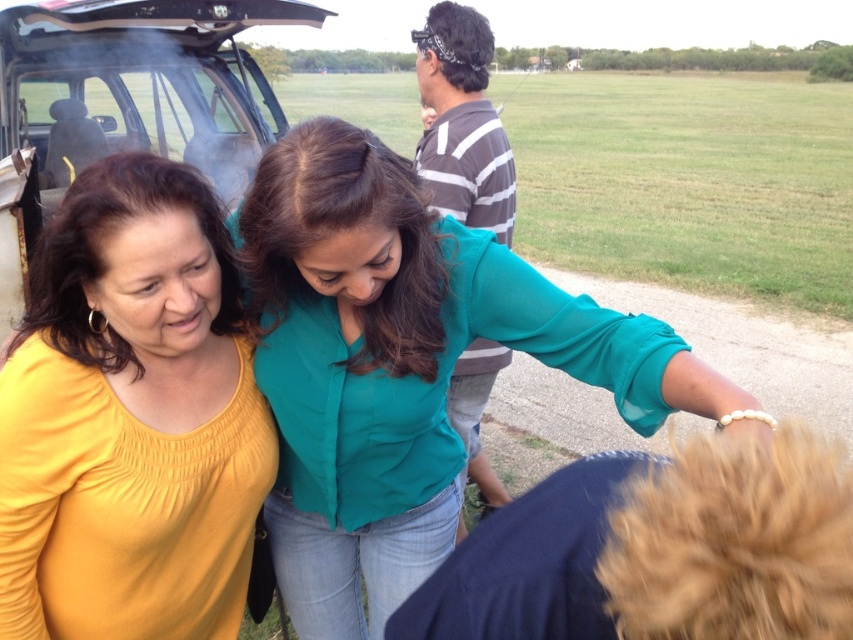
Question: Which point is farther to the camera?

Choices:
 (A) (207, 124)
 (B) (474, 365)
 (C) (189, 419)

Answer: (A)

Question: Is teal satin blouse at center thinner than yellow matte shirt at left?

Choices:
 (A) no
 (B) yes

Answer: (A)

Question: Does yellow matte shirt at left appear under metallic silver car at upper left?

Choices:
 (A) no
 (B) yes

Answer: (B)

Question: Which object is farther from the camera taking this photo?

Choices:
 (A) yellow matte shirt at left
 (B) metallic silver car at upper left
 (C) striped cotton shirt at center

Answer: (B)

Question: From the image, what is the correct spatial relationship of teal satin blouse at center in relation to striped cotton shirt at center?

Choices:
 (A) above
 (B) below

Answer: (A)

Question: Which object is positioned farthest from the teal satin blouse at center?

Choices:
 (A) metallic silver car at upper left
 (B) striped cotton shirt at center

Answer: (A)